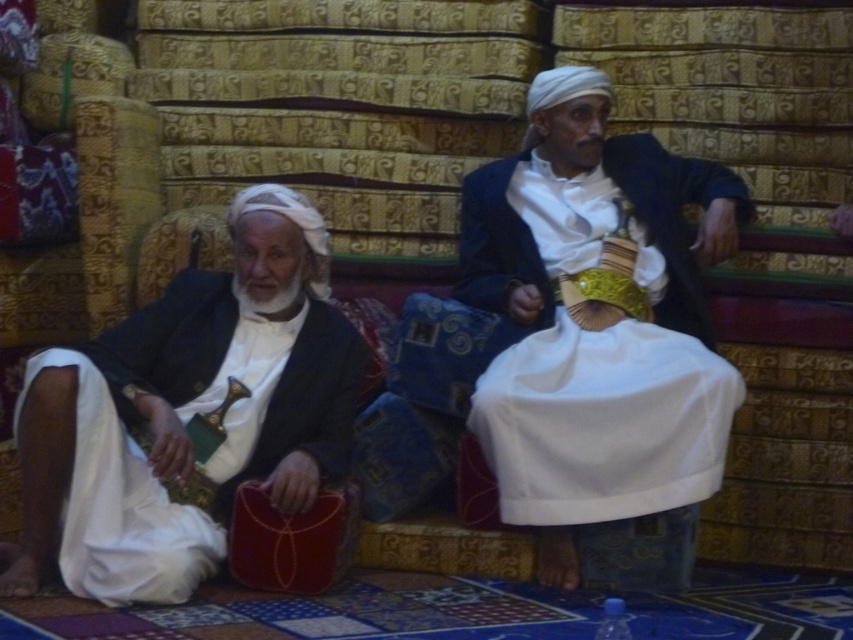
Can you confirm if matte black jacket at center is positioned below matte black suit at left?

Incorrect, matte black jacket at center is not positioned below matte black suit at left.

Is point (602, 381) more distant than point (134, 360)?

No, it is in front of (134, 360).

Is point (497, 276) in front of point (244, 364)?

No, (497, 276) is further to viewer.

Where is `matte black jacket at center`? The height and width of the screenshot is (640, 853). matte black jacket at center is located at coordinates (598, 340).